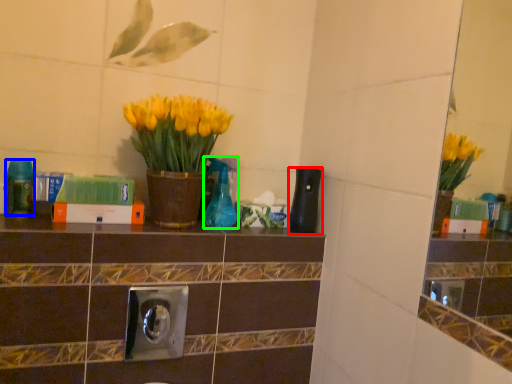
Question: Estimate the real-world distances between objects in this image. Which object is closer to bottle (highlighted by a red box), bottle (highlighted by a blue box) or bottle (highlighted by a green box)?

Choices:
 (A) bottle
 (B) bottle

Answer: (B)